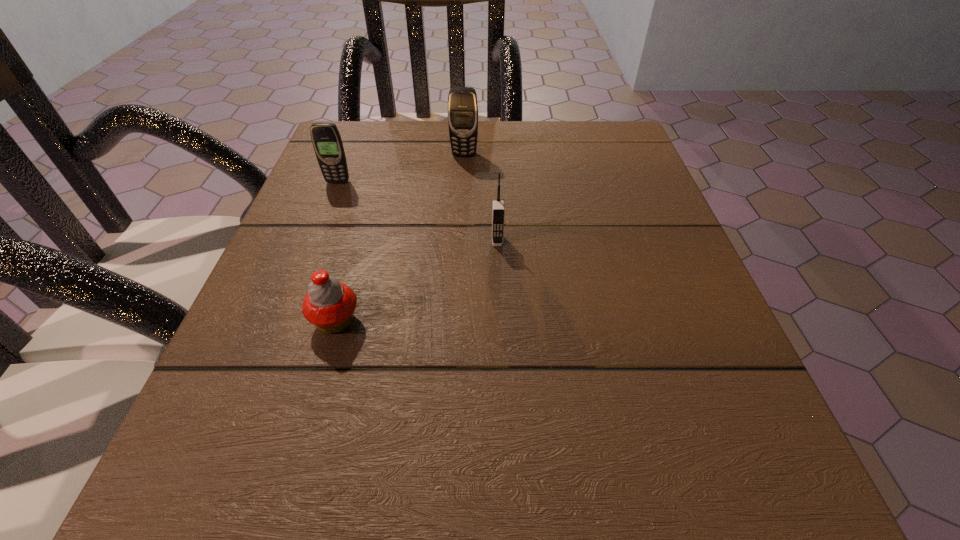
Where is `the second cellular telephone from right to left`? The width and height of the screenshot is (960, 540). the second cellular telephone from right to left is located at coordinates (462, 101).

This screenshot has height=540, width=960. What are the coordinates of `the farthest object` in the screenshot? It's located at (462, 101).

The width and height of the screenshot is (960, 540). I want to click on the third farthest object, so click(498, 209).

Where is `the nearest cellular telephone`? The height and width of the screenshot is (540, 960). the nearest cellular telephone is located at coordinates (498, 209).

This screenshot has height=540, width=960. Find the location of `the leftmost object`. the leftmost object is located at coordinates (326, 139).

This screenshot has height=540, width=960. Identify the location of the second nearest cellular telephone. (326, 139).

The image size is (960, 540). I want to click on the second object from left to right, so click(329, 304).

Locate an element on the screen. The height and width of the screenshot is (540, 960). cupcake is located at coordinates (329, 304).

Where is `vacant region located on the front face of the second object from right to left`? This screenshot has height=540, width=960. vacant region located on the front face of the second object from right to left is located at coordinates (460, 245).

You are a GUI agent. You are given a task and a screenshot of the screen. Output one action in this format:
    pyautogui.click(x=<x>, y=<y>)
    Task: Click on the free region located 0.050m on the front-facing side of the rightmost object
    The image size is (960, 540).
    Given the screenshot: What is the action you would take?
    pyautogui.click(x=498, y=268)